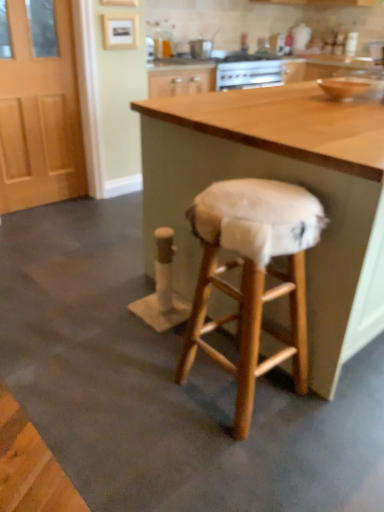
Question: Does white fabric-covered stool at center turn towards wooden table at center?

Choices:
 (A) no
 (B) yes

Answer: (B)

Question: Can you confirm if white fabric-covered stool at center is positioned to the left of wooden table at center?

Choices:
 (A) no
 (B) yes

Answer: (B)

Question: Is white fabric-covered stool at center taller than wooden table at center?

Choices:
 (A) no
 (B) yes

Answer: (A)

Question: Is white fabric-covered stool at center outside wooden table at center?

Choices:
 (A) yes
 (B) no

Answer: (A)

Question: Is white fabric-covered stool at center closer to the viewer compared to wooden table at center?

Choices:
 (A) yes
 (B) no

Answer: (A)

Question: In terms of width, does wooden table at center look wider or thinner when compared to white fabric-covered stool at center?

Choices:
 (A) thin
 (B) wide

Answer: (B)

Question: In terms of height, does wooden table at center look taller or shorter compared to white fabric-covered stool at center?

Choices:
 (A) tall
 (B) short

Answer: (A)

Question: From the image's perspective, is wooden table at center above or below white fabric-covered stool at center?

Choices:
 (A) below
 (B) above

Answer: (B)

Question: Do you think wooden table at center is within white fabric-covered stool at center, or outside of it?

Choices:
 (A) outside
 (B) inside

Answer: (A)

Question: Would you say white fabric-covered stool at center is to the left or to the right of wooden table at center in the picture?

Choices:
 (A) left
 (B) right

Answer: (A)

Question: Looking at their shapes, would you say white fabric-covered stool at center is wider or thinner than wooden table at center?

Choices:
 (A) thin
 (B) wide

Answer: (A)

Question: In terms of size, does white fabric-covered stool at center appear bigger or smaller than wooden table at center?

Choices:
 (A) big
 (B) small

Answer: (B)

Question: From their relative heights in the image, would you say white fabric-covered stool at center is taller or shorter than wooden table at center?

Choices:
 (A) short
 (B) tall

Answer: (A)

Question: Would you say light brown wooden door at left is to the left or to the right of white fabric-covered stool at center in the picture?

Choices:
 (A) left
 (B) right

Answer: (A)

Question: Relative to white fabric-covered stool at center, is light brown wooden door at left in front or behind?

Choices:
 (A) behind
 (B) front

Answer: (A)